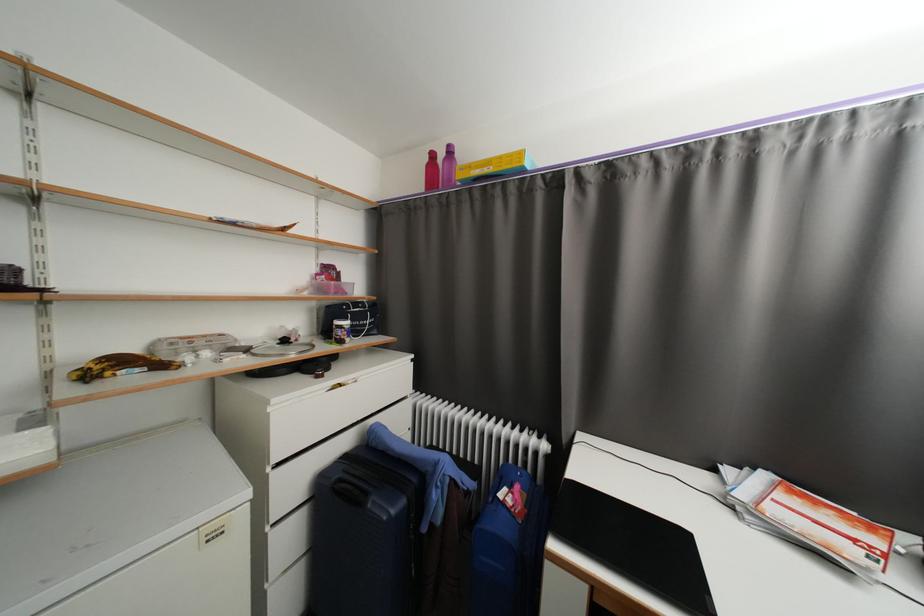
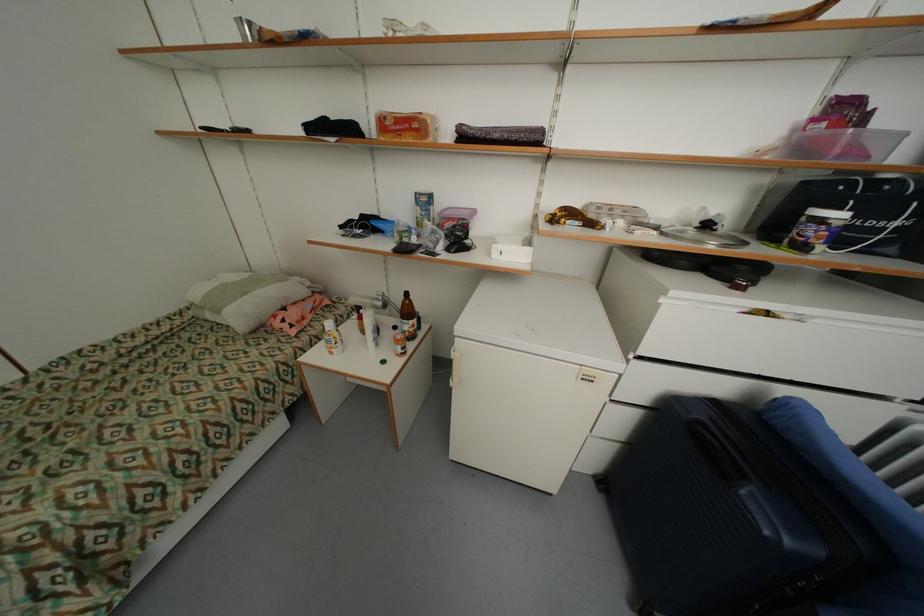
In the second image, find the point that corresponds to point 346,334 in the first image.

(819, 233)